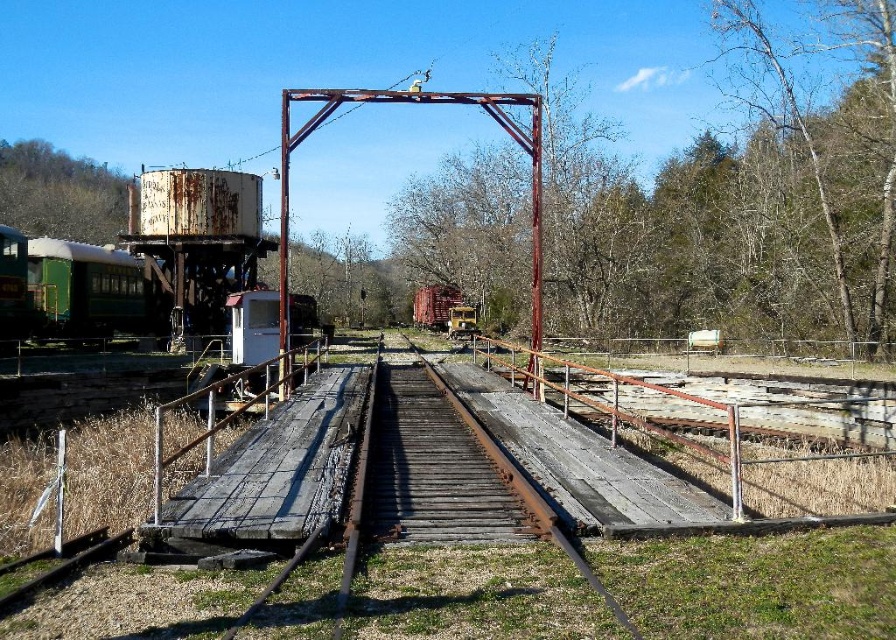
You are a maintenance worker at the railway site. You need to inspect both the green painted metal train car at left and the rusty metal train car at center. Given that you can only carry a 50 feet long extension cord, will you be able to safely plug in your tools between these two train cars?

The green painted metal train car at left is 75.08 feet from the rusty metal train car at center. Since the extension cord is only 50 feet long, it is not long enough to safely reach between the two train cars.

You are a railway inspector standing at the crossing and need to inspect both the green painted metal train car at left and the rusty metal train car at center. Which train car should you inspect first if you want to check the one nearest to you first?

You should inspect the green painted metal train car at left first because it is closer to you than the rusty metal train car at center.

You are a maintenance worker assessing the railway crossing. You need to determine which train car is shorter between the green painted metal train car at left and the rusty metal train car at center. Which one is shorter?

The green painted metal train car at left has a lesser height compared to the rusty metal train car at center, so the green painted metal train car at left is shorter.